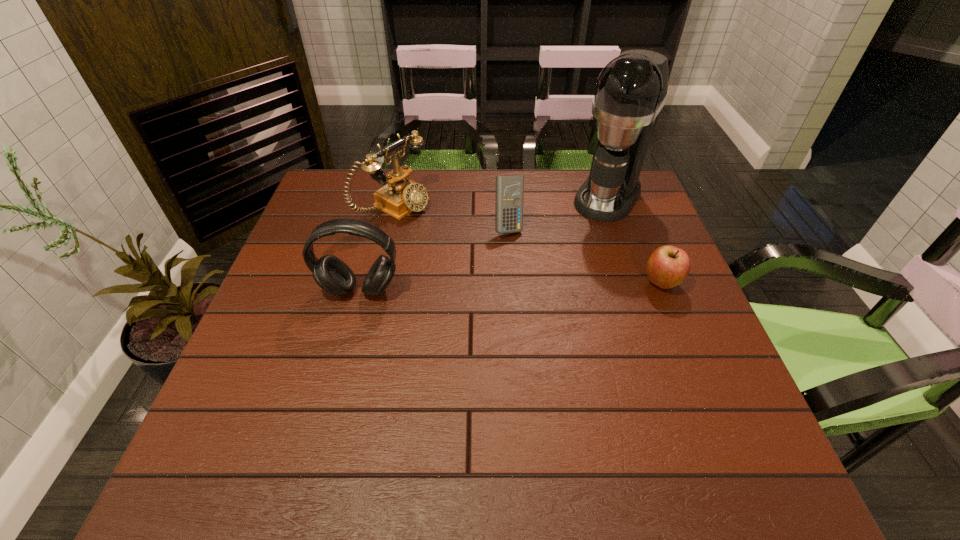
Image resolution: width=960 pixels, height=540 pixels. I want to click on vacant space on the desktop that is between the headset and the apple and is positioned on the dial number of the telephone, so click(x=542, y=286).

I want to click on vacant space on the desktop that is between the headset and the shortest object and is positioned on the front-facing side of the third object from left to right, so click(539, 286).

Where is `vacant space on the desktop that is between the headset and the apple and is positioned place cup under the spout of the tallest object`? vacant space on the desktop that is between the headset and the apple and is positioned place cup under the spout of the tallest object is located at coordinates coord(548,286).